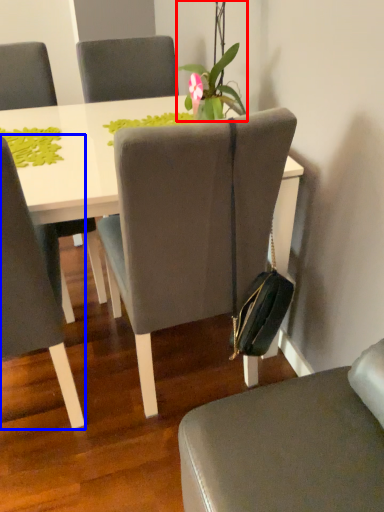
Question: Among these objects, which one is nearest to the camera, houseplant (highlighted by a red box) or chair (highlighted by a blue box)?

Choices:
 (A) houseplant
 (B) chair

Answer: (B)